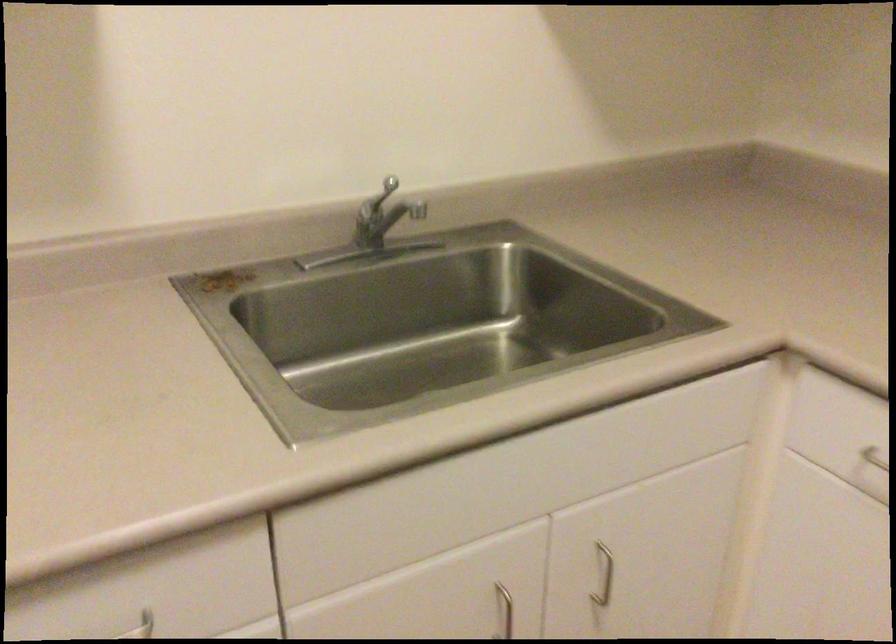
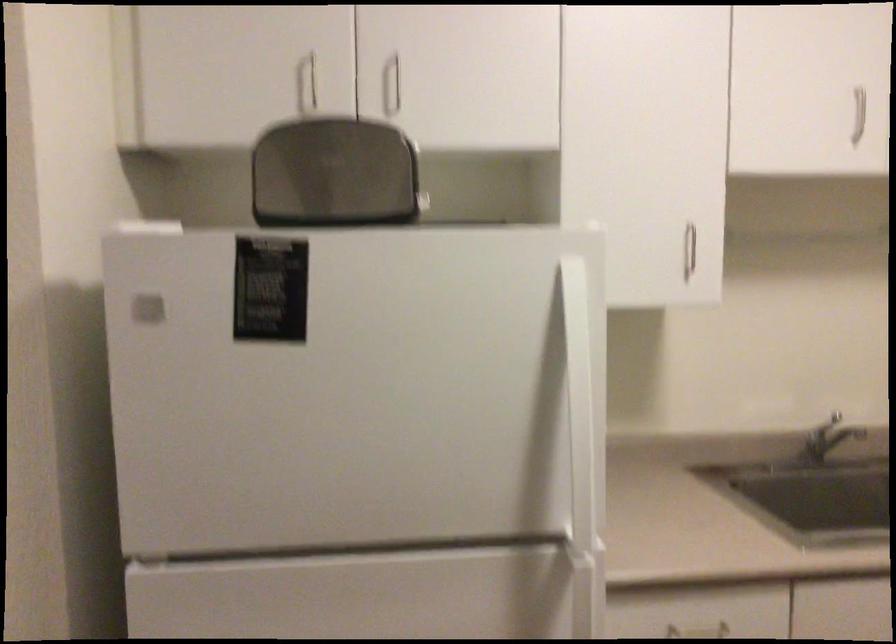
How did the camera likely rotate?

The camera's rotation is toward left-up.